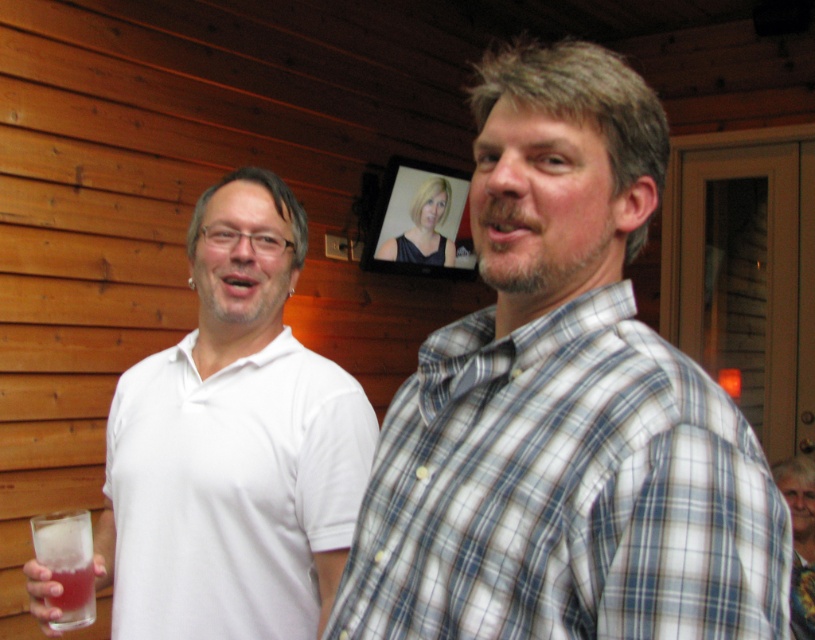
Question: Which object is the farthest from the blue-gray plaid shirt at right?

Choices:
 (A) translucent glass at lower left
 (B) white matte shirt at left

Answer: (A)

Question: Which of the following is the closest to the observer?

Choices:
 (A) (53, 602)
 (B) (214, 412)
 (C) (540, 433)

Answer: (C)

Question: Does blue-gray plaid shirt at right appear on the left side of white matte shirt at left?

Choices:
 (A) yes
 (B) no

Answer: (B)

Question: Does white matte shirt at left appear over translucent glass at lower left?

Choices:
 (A) yes
 (B) no

Answer: (A)

Question: Can you confirm if blue-gray plaid shirt at right is positioned above translucent glass at lower left?

Choices:
 (A) no
 (B) yes

Answer: (B)

Question: Estimate the real-world distances between objects in this image. Which object is closer to the translucent glass at lower left?

Choices:
 (A) blue-gray plaid shirt at right
 (B) white matte shirt at left

Answer: (B)